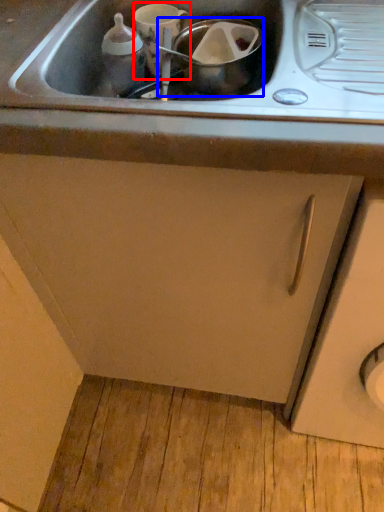
Question: Which object is closer to the camera taking this photo, appliance (highlighted by a red box) or appliance (highlighted by a blue box)?

Choices:
 (A) appliance
 (B) appliance

Answer: (B)